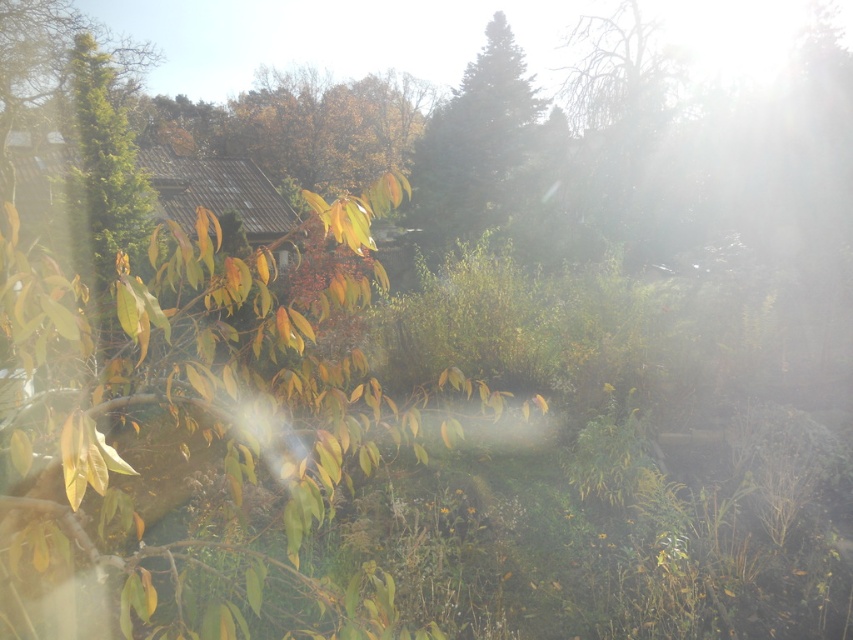
Question: Is green matte tree at center positioned before green textured tree at left?

Choices:
 (A) no
 (B) yes

Answer: (A)

Question: Is green matte tree at center behind green textured tree at left?

Choices:
 (A) yes
 (B) no

Answer: (A)

Question: Which object is closer to the camera taking this photo?

Choices:
 (A) green textured tree at left
 (B) green matte tree at center

Answer: (A)

Question: Is green matte tree at center smaller than green textured tree at left?

Choices:
 (A) yes
 (B) no

Answer: (A)

Question: Which point appears closest to the camera in this image?

Choices:
 (A) (463, 113)
 (B) (82, 154)

Answer: (B)